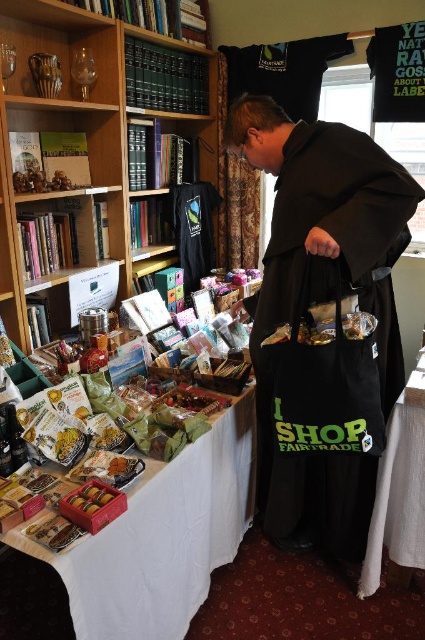
Image resolution: width=425 pixels, height=640 pixels. Describe the element at coordinates (88, 150) in the screenshot. I see `wooden bookcase at upper left` at that location.

Between point (107, 237) and point (193, 508), which one is positioned behind?

The point (107, 237) is more distant.

Locate an element on the screen. wooden bookcase at upper left is located at coordinates (88, 150).

Is point (178, 582) positioned before point (422, 440)?

Yes, point (178, 582) is in front of point (422, 440).

Which is more to the left, white fabric table at lower left or white fabric at lower right?

white fabric table at lower left

Which is behind, point (70, 561) or point (394, 522)?

The point (394, 522) is behind.

This screenshot has height=640, width=425. What are the coordinates of `white fabric table at lower left` in the screenshot? It's located at (163, 538).

Between point (300, 496) and point (382, 458), which one is positioned in front?

Point (382, 458) is more forward.

Who is positioned more to the left, black matte robe at center or white fabric at lower right?

black matte robe at center is more to the left.

Where is `black matte robe at center`? black matte robe at center is located at coordinates (320, 301).

Where is `black matte robe at center`? The image size is (425, 640). black matte robe at center is located at coordinates 320,301.